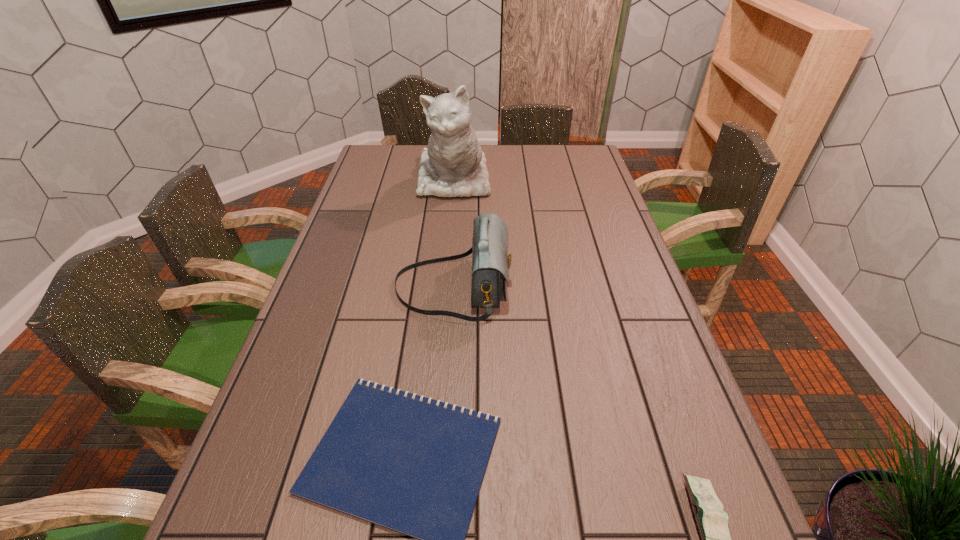
This screenshot has width=960, height=540. I want to click on the farthest object, so click(454, 165).

Locate an element on the screen. This screenshot has height=540, width=960. the tallest object is located at coordinates (454, 165).

Where is `the second farthest object`? the second farthest object is located at coordinates (490, 261).

At what (x,y) coordinates should I click in order to perform the action: click on the third shortest object. Please return your answer as a coordinate pair (x, y). This screenshot has height=540, width=960. Looking at the image, I should click on (490, 261).

You are a GUI agent. You are given a task and a screenshot of the screen. Output one action in this format:
    pyautogui.click(x=<x>, y=<y>)
    Task: Click on the vacant area situated on the front-facing side of the cat
    This screenshot has height=540, width=960.
    Given the screenshot: What is the action you would take?
    pyautogui.click(x=448, y=247)

The height and width of the screenshot is (540, 960). In order to click on free point located on the front of the shoulder bag in this screenshot , I will do `click(443, 434)`.

Identify the location of object that is at the far edge. This screenshot has height=540, width=960. (454, 165).

I want to click on vacant region at the left edge, so click(x=351, y=205).

In the image, there is a desktop. Identify the location of vacant space at the right edge. The width and height of the screenshot is (960, 540). (587, 181).

In the image, there is a desktop. What are the coordinates of `vacant region at the far left corner` in the screenshot? It's located at (374, 168).